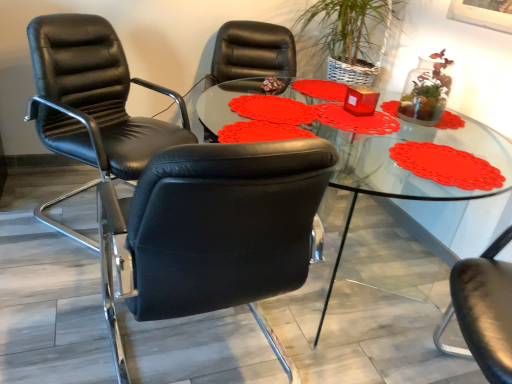
Question: In terms of size, does black leather chair at left, marked as the first chair in a front-to-back arrangement, appear bigger or smaller than transparent glass table at center?

Choices:
 (A) big
 (B) small

Answer: (B)

Question: Is black leather chair at left, the second chair viewed from the back, wider or thinner than transparent glass table at center?

Choices:
 (A) thin
 (B) wide

Answer: (A)

Question: Which of these objects is positioned farthest from the black leather chair at left, which is the 2th chair from front to back?

Choices:
 (A) transparent glass table at center
 (B) black leather chair at left, marked as the first chair in a front-to-back arrangement

Answer: (B)

Question: Estimate the real-world distances between objects in this image. Which object is farther from the black leather chair at left, which is the 2th chair from front to back?

Choices:
 (A) transparent glass table at center
 (B) black leather chair at left, the second chair viewed from the back

Answer: (B)